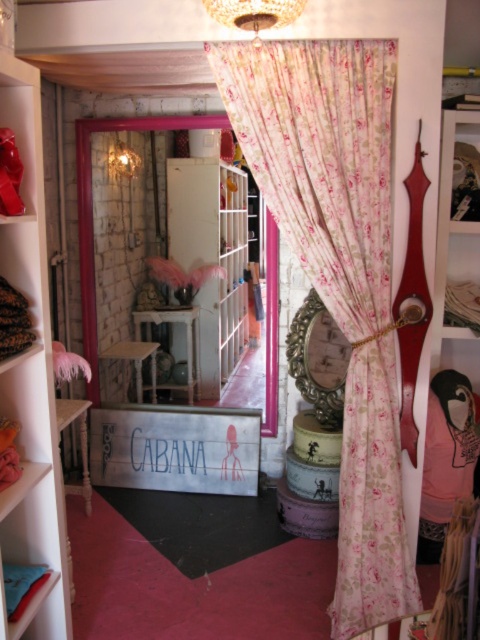
What do you see at coordinates (337, 273) in the screenshot?
I see `floral fabric curtain at center` at bounding box center [337, 273].

Which of these two, floral fabric curtain at center or white wood shelf at left, stands taller?

With more height is floral fabric curtain at center.

Where is `floral fabric curtain at center`? The width and height of the screenshot is (480, 640). floral fabric curtain at center is located at coordinates (337, 273).

I want to click on floral fabric curtain at center, so click(x=337, y=273).

Who is taller, white wood shelf at left or crystal glass chandelier at upper center?

white wood shelf at left

Does point (36, 300) come closer to viewer compared to point (208, 6)?

That is False.

Find the location of a particular element. Image resolution: width=480 pixels, height=640 pixels. white wood shelf at left is located at coordinates (32, 378).

Is floral fabric curtain at center bigger than crystal glass chandelier at upper center?

Yes.

Which is in front, point (370, 547) or point (274, 20)?

Point (274, 20) is more forward.

The image size is (480, 640). Find the location of `floral fabric curtain at center`. floral fabric curtain at center is located at coordinates (337, 273).